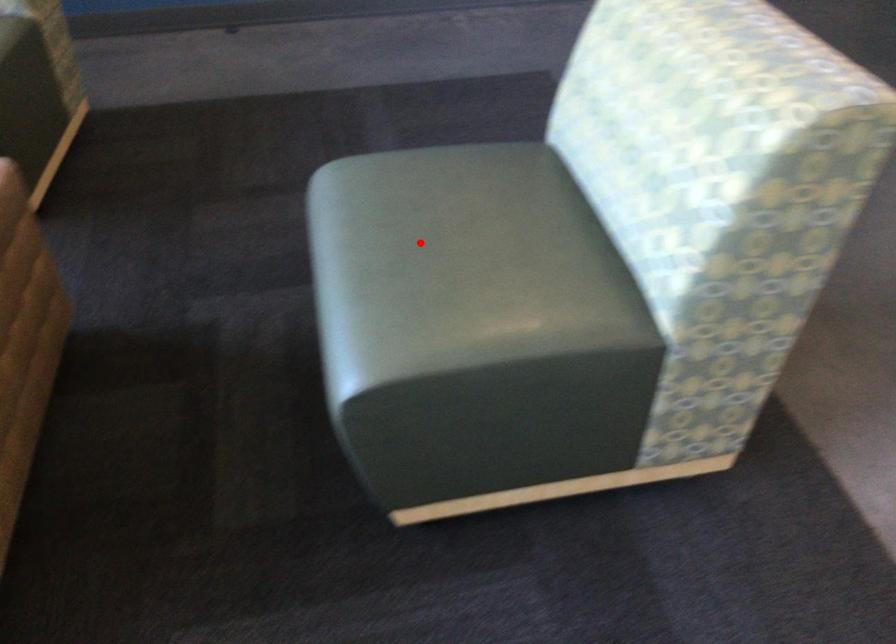
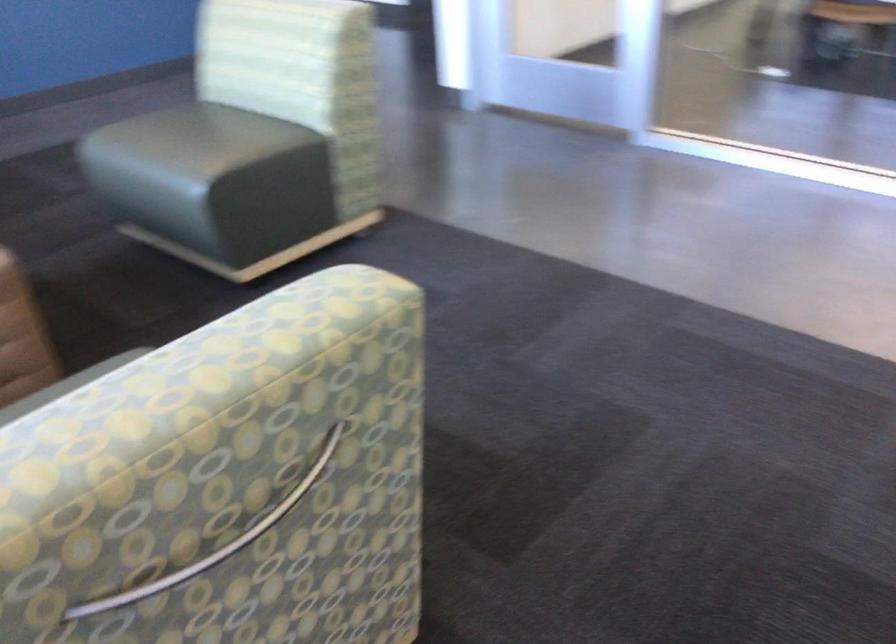
Question: I am providing you with two images of the same scene from different viewpoints. Image1 has a red point marked. In image2, the corresponding 3D location appears at what relative position? Reply with the corresponding letter.

Choices:
 (A) Closer
 (B) Farther

Answer: (B)